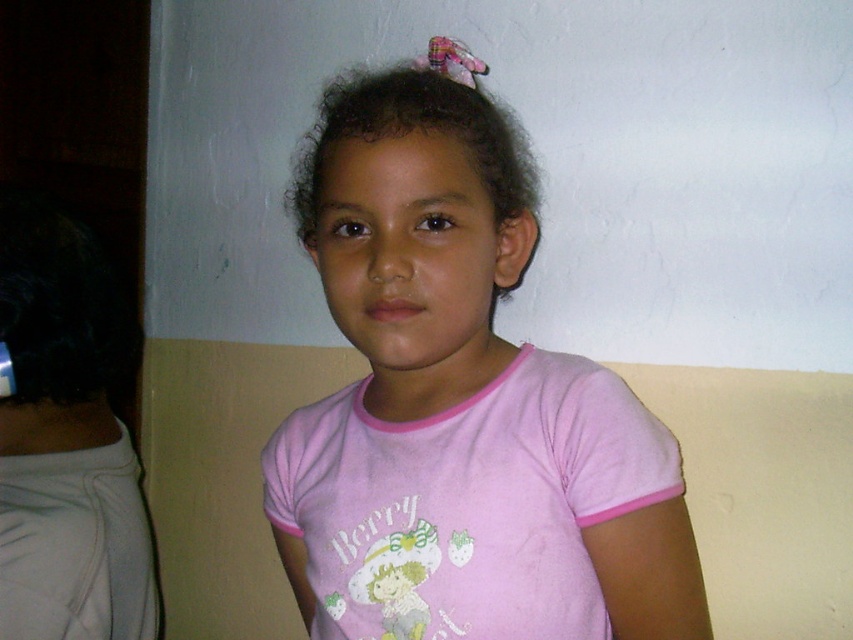
You are standing in the room where the young girl is photographed. You notice two points marked at coordinates point (48, 588) and point (366, 88). Which point is closer to you as you face the girl?

Point (48, 588) is closer to you because it is further to the viewer than point (366, 88).

You are standing in the room where the young girl is photographed. You want to place a small sticker exactly at the point marked as point (71, 458). If your hand can reach up to 1 meter, can you comfortably place the sticker there?

The distance of point (71, 458) from camera is 1.01 meters, so your hand can reach up to 1 meter, so you cannot comfortably place the sticker there because it is slightly farther than your reach.

You are a photographer adjusting your camera settings. You notice the pink cotton shirt at center and the white fabric at left in the frame. Which object should you focus on to ensure the subject is sharp?

You should focus on the pink cotton shirt at center because it is closer to the viewer than the white fabric at left, ensuring the subject is in sharp focus.